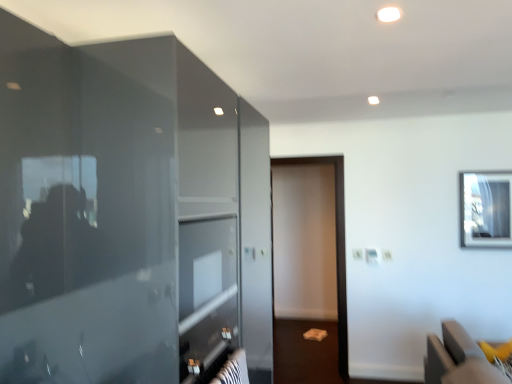
This screenshot has height=384, width=512. Find the location of `free point above clear glass window at upper right (from a real-world perspective)`. free point above clear glass window at upper right (from a real-world perspective) is located at coordinates (481, 166).